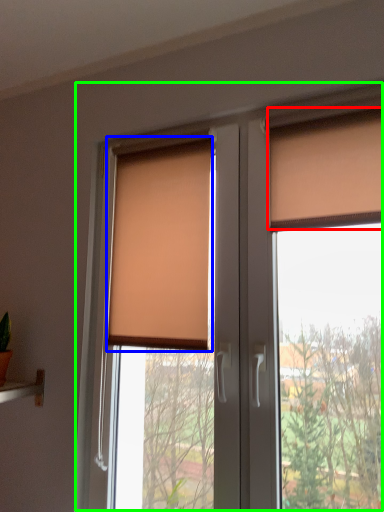
Question: Based on their relative distances, which object is farther from curtain (highlighted by a red box)? Choose from window blind (highlighted by a blue box) and window (highlighted by a green box).

Choices:
 (A) window blind
 (B) window

Answer: (A)